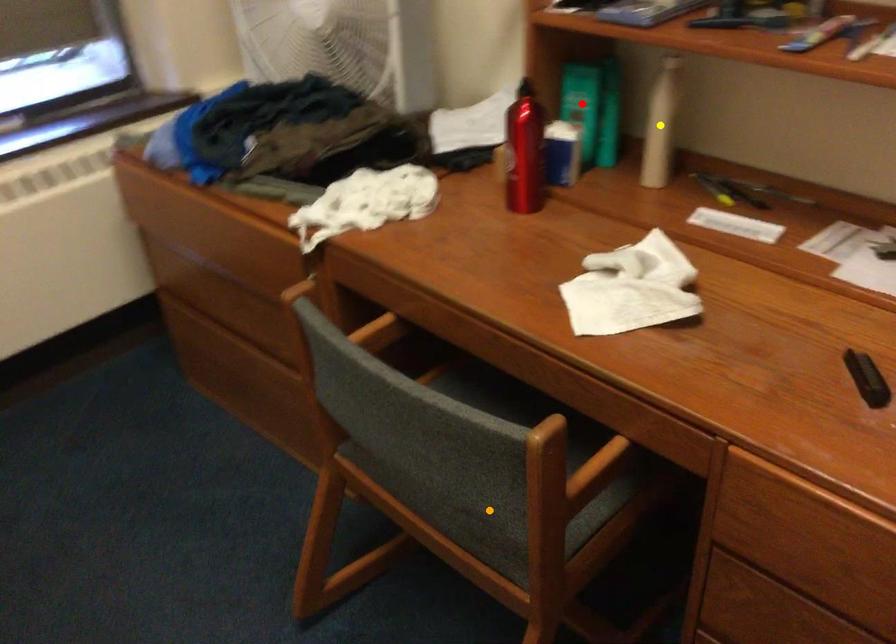
Order these from nearest to farthest:
red point | yellow point | orange point

orange point, yellow point, red point